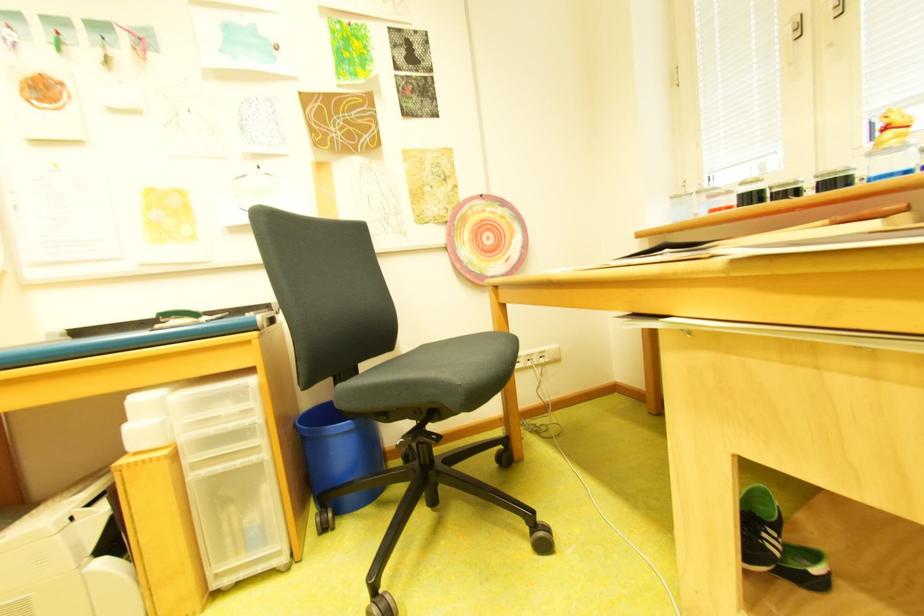
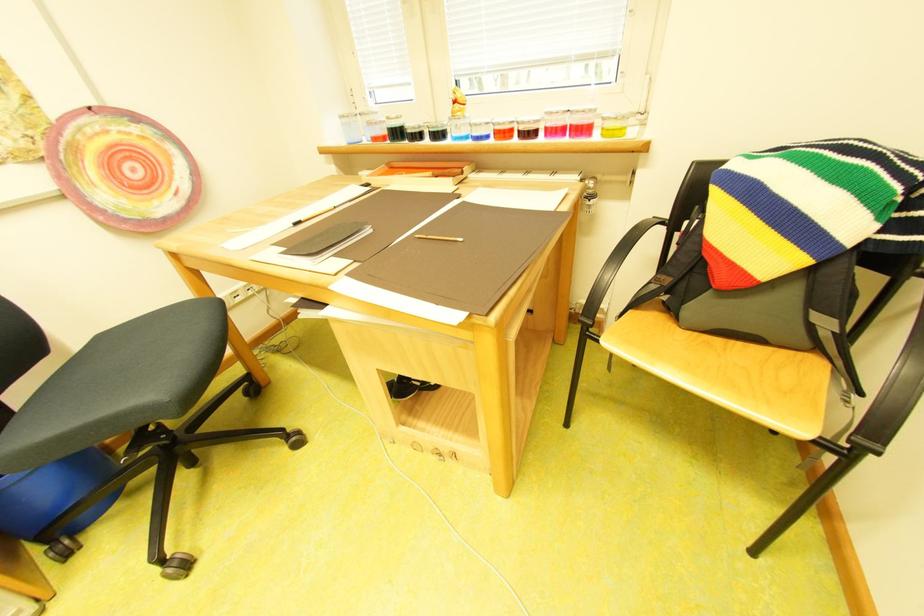
Find the pixel in the second image that matches (x=359, y=499) in the first image.

(96, 515)